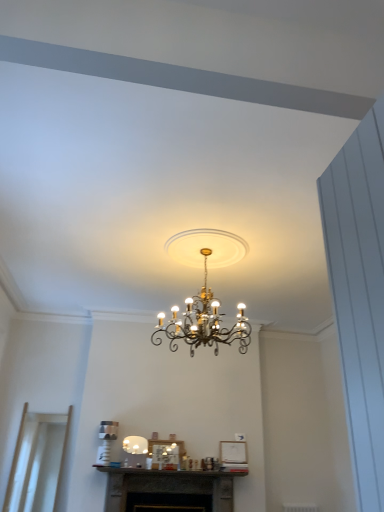
You are a GUI agent. You are given a task and a screenshot of the screen. Output one action in this format:
    pyautogui.click(x=<x>, y=<y>)
    Task: Click on the transparent glass door at lower left
    The width and height of the screenshot is (384, 512).
    Given the screenshot: What is the action you would take?
    pyautogui.click(x=37, y=462)

Looking at this image, between gold metallic chandelier at center, which is counted as the 1th lamp, starting from the right, and transparent glass door at lower left, which one has smaller width?

transparent glass door at lower left is thinner.

Which point is more distant from viewer, [213,335] or [16,477]?

The point [16,477] is behind.

Is gold metallic chandelier at center, the 1th lamp in the top-to-bottom sequence, further to the viewer compared to transparent glass door at lower left?

No.

What are the coordinates of `lamp that is the 2nd one above the transparent glass door at lower left (from a real-world perspective)` in the screenshot? It's located at (203, 322).

How distant is gold metallic chandelier at center, the 1th lamp in the top-to-bottom sequence, from dark gray stone fireplace at center?

gold metallic chandelier at center, the 1th lamp in the top-to-bottom sequence, is 7.16 feet away from dark gray stone fireplace at center.

There is a dark gray stone fireplace at center. Where is `the 2nd lamp above it (from the image's perspective)`? This screenshot has height=512, width=384. the 2nd lamp above it (from the image's perspective) is located at coordinates (203, 322).

What's the angular difference between gold metallic chandelier at center, the 1th lamp positioned from the front, and dark gray stone fireplace at center's facing directions?

The angle between the facing direction of gold metallic chandelier at center, the 1th lamp positioned from the front, and the facing direction of dark gray stone fireplace at center is 1.08 degrees.

From a real-world perspective, is gold metallic chandelier at center, positioned as the second lamp in back-to-front order, positioned above or below dark gray stone fireplace at center?

Clearly, from a real-world perspective, gold metallic chandelier at center, positioned as the second lamp in back-to-front order, is above dark gray stone fireplace at center.

Could you measure the distance between transparent glass door at lower left and white glossy lampshade at center, which is the 2th lamp in right-to-left order?

A distance of 1.10 meters exists between transparent glass door at lower left and white glossy lampshade at center, which is the 2th lamp in right-to-left order.

Consider the image. Can you tell me how much transparent glass door at lower left and white glossy lampshade at center, positioned as the 1th lamp in left-to-right order, differ in facing direction?

The facing directions of transparent glass door at lower left and white glossy lampshade at center, positioned as the 1th lamp in left-to-right order, are 2.31 degrees apart.

Would you say transparent glass door at lower left is inside or outside white glossy lampshade at center, placed as the first lamp when sorted from bottom to top?

transparent glass door at lower left is located beyond the bounds of white glossy lampshade at center, placed as the first lamp when sorted from bottom to top.

Which object is wider, transparent glass door at lower left or white glossy lampshade at center, which ranks as the 2th lamp in top-to-bottom order?

transparent glass door at lower left.

Does point (225, 339) appear closer or farther from the camera than point (140, 440)?

Clearly, point (225, 339) is closer to the camera than point (140, 440).

Which of these two, gold metallic chandelier at center, which is counted as the 1th lamp, starting from the right, or white glossy lampshade at center, which is the 2th lamp in right-to-left order, is thinner?

Thinner between the two is white glossy lampshade at center, which is the 2th lamp in right-to-left order.

Consider the image. From the image's perspective, is gold metallic chandelier at center, which is the second lamp from bottom to top, above white glossy lampshade at center, which is the 2th lamp from front to back?

Yes, from the image's perspective, gold metallic chandelier at center, which is the second lamp from bottom to top, is over white glossy lampshade at center, which is the 2th lamp from front to back.

In terms of height, does gold metallic chandelier at center, the 1th lamp in the top-to-bottom sequence, look taller or shorter compared to white glossy lampshade at center, which ranks as the 1th lamp in back-to-front order?

Considering their sizes, gold metallic chandelier at center, the 1th lamp in the top-to-bottom sequence, has more height than white glossy lampshade at center, which ranks as the 1th lamp in back-to-front order.

How far apart are dark gray stone fireplace at center and gold metallic chandelier at center, positioned as the second lamp in back-to-front order?

The distance of dark gray stone fireplace at center from gold metallic chandelier at center, positioned as the second lamp in back-to-front order, is 2.18 meters.

Between dark gray stone fireplace at center and gold metallic chandelier at center, the 1th lamp positioned from the front, which one appears on the left side from the viewer's perspective?

From the viewer's perspective, dark gray stone fireplace at center appears more on the left side.

Considering the relative sizes of dark gray stone fireplace at center and gold metallic chandelier at center, positioned as the second lamp in back-to-front order, in the image provided, is dark gray stone fireplace at center wider than gold metallic chandelier at center, positioned as the second lamp in back-to-front order,?

In fact, dark gray stone fireplace at center might be narrower than gold metallic chandelier at center, positioned as the second lamp in back-to-front order.

Is dark gray stone fireplace at center closer to camera compared to gold metallic chandelier at center, the 1th lamp positioned from the front?

No, it is behind gold metallic chandelier at center, the 1th lamp positioned from the front.

Would you say transparent glass door at lower left is a long distance from dark gray stone fireplace at center?

Yes.

Considering the positions of objects transparent glass door at lower left and dark gray stone fireplace at center in the image provided, who is more to the left, transparent glass door at lower left or dark gray stone fireplace at center?

Positioned to the left is transparent glass door at lower left.

Is transparent glass door at lower left shorter than dark gray stone fireplace at center?

No, transparent glass door at lower left is not shorter than dark gray stone fireplace at center.

The height and width of the screenshot is (512, 384). I want to click on glass door that is behind the dark gray stone fireplace at center, so click(37, 462).

Would you say transparent glass door at lower left is inside or outside gold metallic chandelier at center, the 1th lamp in the top-to-bottom sequence?

transparent glass door at lower left lies outside gold metallic chandelier at center, the 1th lamp in the top-to-bottom sequence.

From the image's perspective, which one is positioned higher, transparent glass door at lower left or gold metallic chandelier at center, which is counted as the 2th lamp, starting from the left?

From the image's view, gold metallic chandelier at center, which is counted as the 2th lamp, starting from the left, is above.

Is transparent glass door at lower left oriented towards gold metallic chandelier at center, which is counted as the 2th lamp, starting from the left?

No.

Between transparent glass door at lower left and gold metallic chandelier at center, which is counted as the 1th lamp, starting from the right, which one has smaller width?

transparent glass door at lower left.

This screenshot has width=384, height=512. Identify the location of the 2nd lamp directly above the transparent glass door at lower left (from a real-world perspective). (203, 322).

Image resolution: width=384 pixels, height=512 pixels. Identify the location of fireplace beneath the gold metallic chandelier at center, which is the second lamp from bottom to top (from a real-world perspective). (168, 486).

Based on their spatial positions, is dark gray stone fireplace at center or transparent glass door at lower left closer to gold metallic chandelier at center, which is counted as the 2th lamp, starting from the left?

Based on the image, dark gray stone fireplace at center appears to be nearer to gold metallic chandelier at center, which is counted as the 2th lamp, starting from the left.

When comparing their distances from transparent glass door at lower left, does dark gray stone fireplace at center or gold metallic chandelier at center, which is counted as the 1th lamp, starting from the right, seem further?

The object further to transparent glass door at lower left is gold metallic chandelier at center, which is counted as the 1th lamp, starting from the right.

Considering their positions, is transparent glass door at lower left positioned closer to gold metallic chandelier at center, positioned as the second lamp in back-to-front order, than dark gray stone fireplace at center?

dark gray stone fireplace at center lies closer to gold metallic chandelier at center, positioned as the second lamp in back-to-front order, than the other object.

Looking at the image, which one is located closer to white glossy lampshade at center, positioned as the 1th lamp in left-to-right order, gold metallic chandelier at center, positioned as the second lamp in back-to-front order, or dark gray stone fireplace at center?

The object closer to white glossy lampshade at center, positioned as the 1th lamp in left-to-right order, is dark gray stone fireplace at center.

When comparing their distances from white glossy lampshade at center, which is the 2th lamp from front to back, does transparent glass door at lower left or gold metallic chandelier at center, the 1th lamp positioned from the front, seem closer?

Based on the image, transparent glass door at lower left appears to be nearer to white glossy lampshade at center, which is the 2th lamp from front to back.

Which object lies nearer to the anchor point transparent glass door at lower left, white glossy lampshade at center, which is the 2th lamp from front to back, or dark gray stone fireplace at center?

dark gray stone fireplace at center lies closer to transparent glass door at lower left than the other object.

Based on their spatial positions, is transparent glass door at lower left or dark gray stone fireplace at center further from white glossy lampshade at center, which ranks as the 2th lamp in top-to-bottom order?

transparent glass door at lower left is further to white glossy lampshade at center, which ranks as the 2th lamp in top-to-bottom order.

From the image, which object appears to be farther from white glossy lampshade at center, which is the 2th lamp in right-to-left order, gold metallic chandelier at center, positioned as the second lamp in back-to-front order, or transparent glass door at lower left?

gold metallic chandelier at center, positioned as the second lamp in back-to-front order, is further to white glossy lampshade at center, which is the 2th lamp in right-to-left order.

You are a GUI agent. You are given a task and a screenshot of the screen. Output one action in this format:
    pyautogui.click(x=<x>, y=<y>)
    Task: Click on the glass door between gold metallic chandelier at center, which is counted as the 2th lamp, starting from the left, and dark gray stone fireplace at center vertically
    This screenshot has height=512, width=384.
    Given the screenshot: What is the action you would take?
    pyautogui.click(x=37, y=462)

Where is `lamp between gold metallic chandelier at center, which is counted as the 2th lamp, starting from the left, and transparent glass door at lower left from top to bottom`? lamp between gold metallic chandelier at center, which is counted as the 2th lamp, starting from the left, and transparent glass door at lower left from top to bottom is located at coordinates (135, 445).

The height and width of the screenshot is (512, 384). I want to click on lamp between gold metallic chandelier at center, positioned as the second lamp in back-to-front order, and dark gray stone fireplace at center vertically, so click(135, 445).

You are a GUI agent. You are given a task and a screenshot of the screen. Output one action in this format:
    pyautogui.click(x=<x>, y=<y>)
    Task: Click on the lamp between transparent glass door at lower left and dark gray stone fireplace at center from left to right
    This screenshot has width=384, height=512.
    Given the screenshot: What is the action you would take?
    pyautogui.click(x=135, y=445)